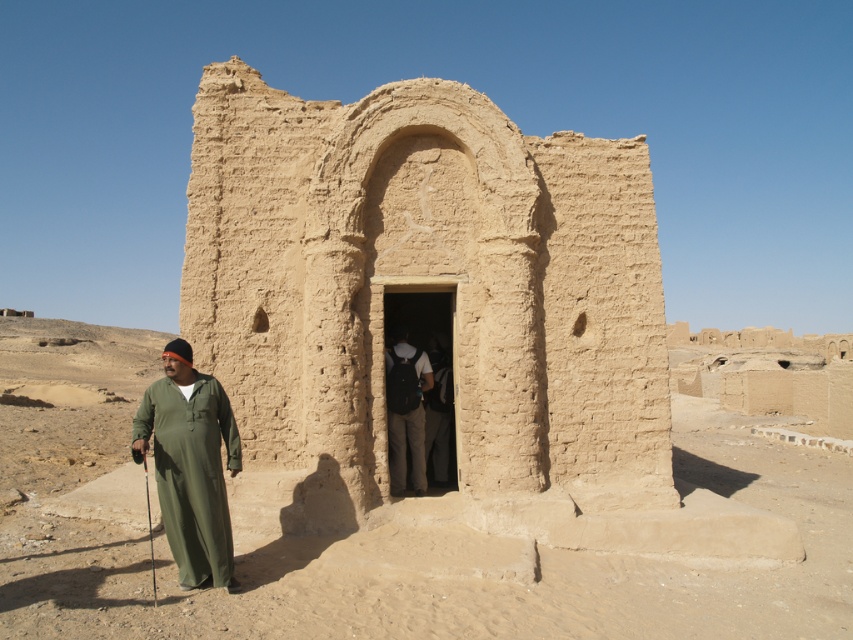
Question: Is earthy clay ruins at center positioned at the back of brown textured wall at center?

Choices:
 (A) no
 (B) yes

Answer: (B)

Question: Does earthy clay ruins at center appear over brown textured wall at center?

Choices:
 (A) yes
 (B) no

Answer: (A)

Question: Does brown textured wall at center appear over green matte robe at left?

Choices:
 (A) yes
 (B) no

Answer: (B)

Question: Which object is farther from the camera taking this photo?

Choices:
 (A) dark gray fabric backpack at center
 (B) brown textured wall at center

Answer: (A)

Question: Estimate the real-world distances between objects in this image. Which object is closer to the earthy clay ruins at center?

Choices:
 (A) brown textured wall at center
 (B) green matte robe at left
 (C) dark gray fabric backpack at center

Answer: (B)

Question: Which of the following is the farthest from the observer?

Choices:
 (A) (419, 465)
 (B) (764, 445)
 (C) (172, 465)
 (D) (596, 234)

Answer: (B)